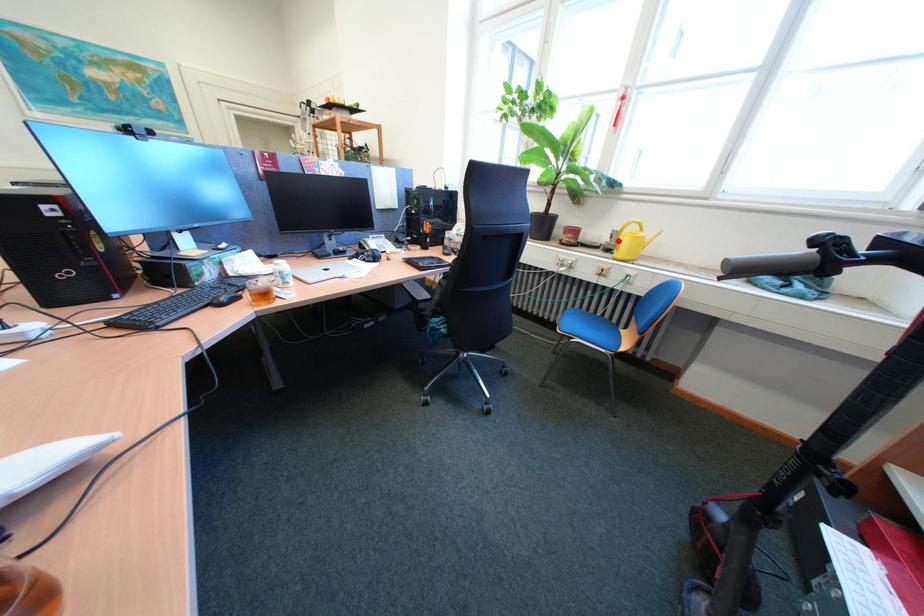
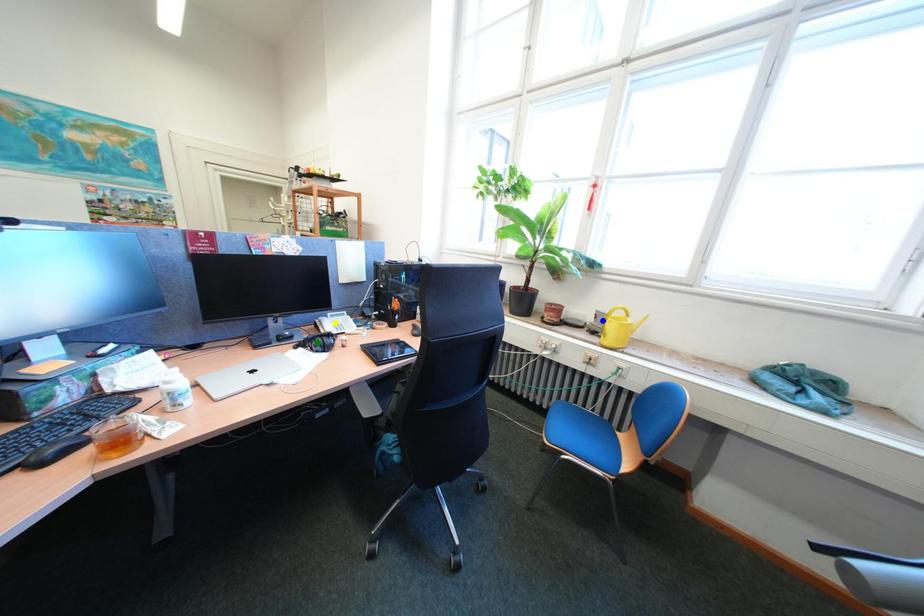
Question: I am providing you with two images of the same scene from different viewpoints. A red point is marked on the first image. You are given multiple points on the second image. In image 2, which mark is for the same physical point as the one in image 1?

Choices:
 (A) yellow point
 (B) green point
 (C) blue point

Answer: (C)